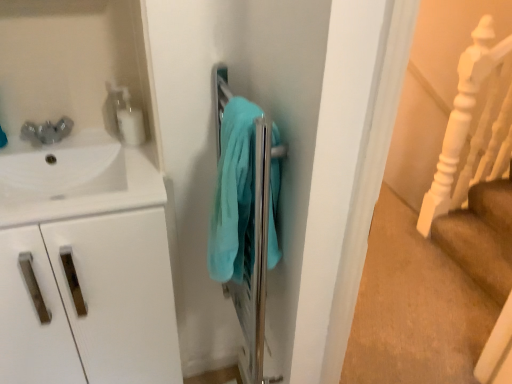
Locate an element on the screen. The image size is (512, 384). white wooden stair rail at right is located at coordinates (461, 117).

This screenshot has height=384, width=512. What do you see at coordinates (461, 117) in the screenshot?
I see `white wooden stair rail at right` at bounding box center [461, 117].

What do you see at coordinates (128, 117) in the screenshot? The image size is (512, 384). I see `white glossy soap dispenser at upper left` at bounding box center [128, 117].

You are a GUI agent. You are given a task and a screenshot of the screen. Output one action in this format:
    pyautogui.click(x=<x>, y=<y>)
    Task: Click on the teal soft towel at center
    This screenshot has height=384, width=512.
    Given the screenshot: What is the action you would take?
    pyautogui.click(x=234, y=196)

Is white matte cabinet at left at the right side of white glossy soap dispenser at upper left?

Incorrect, white matte cabinet at left is not on the right side of white glossy soap dispenser at upper left.

Image resolution: width=512 pixels, height=384 pixels. I want to click on drawer on the left of white glossy soap dispenser at upper left, so click(93, 302).

Which is behind, point (140, 276) or point (134, 113)?

The point (134, 113) is farther from the camera.

How many degrees apart are the facing directions of white matte cabinet at left and white glossy soap dispenser at upper left?

The angle between the facing direction of white matte cabinet at left and the facing direction of white glossy soap dispenser at upper left is 4.95 degrees.

The image size is (512, 384). I want to click on bath towel located in front of the white wooden stair rail at right, so click(234, 196).

Considering the sizes of teal soft towel at center and white wooden stair rail at right in the image, is teal soft towel at center bigger or smaller than white wooden stair rail at right?

Considering their sizes, teal soft towel at center takes up less space than white wooden stair rail at right.

Does teal soft towel at center turn towards white wooden stair rail at right?

No, teal soft towel at center is not oriented towards white wooden stair rail at right.

Is white wooden stair rail at right completely or partially inside teal soft towel at center?

No, teal soft towel at center does not contain white wooden stair rail at right.

Which object is further away from the camera taking this photo, white glossy soap dispenser at upper left or white wooden stair rail at right?

Positioned behind is white wooden stair rail at right.

Is white glossy soap dispenser at upper left not close to white wooden stair rail at right?

white glossy soap dispenser at upper left is far away from white wooden stair rail at right.

Does white glossy soap dispenser at upper left have a lesser width compared to white wooden stair rail at right?

Yes, white glossy soap dispenser at upper left is thinner than white wooden stair rail at right.

Can you tell me how much white glossy soap dispenser at upper left and white wooden stair rail at right differ in facing direction?

The angle between the facing direction of white glossy soap dispenser at upper left and the facing direction of white wooden stair rail at right is 93.3 degrees.

Who is taller, white wooden stair rail at right or white matte cabinet at left?

With more height is white wooden stair rail at right.

How many degrees apart are the facing directions of white wooden stair rail at right and white matte cabinet at left?

The facing directions of white wooden stair rail at right and white matte cabinet at left are 88.4 degrees apart.

Consider the image. From a real-world perspective, is white wooden stair rail at right under white matte cabinet at left?

No, from a real-world perspective, white wooden stair rail at right is not beneath white matte cabinet at left.

Is white wooden stair rail at right in front of white matte cabinet at left?

No, white wooden stair rail at right is further to the viewer.

Can you confirm if white glossy soap dispenser at upper left is taller than white glossy sink at upper left?

No.

Considering the positions of objects white glossy soap dispenser at upper left and white glossy sink at upper left in the image provided, who is behind, white glossy soap dispenser at upper left or white glossy sink at upper left?

Positioned behind is white glossy soap dispenser at upper left.

Measure the distance between white glossy soap dispenser at upper left and white glossy sink at upper left.

white glossy soap dispenser at upper left is 7.46 inches away from white glossy sink at upper left.

Is white glossy soap dispenser at upper left at the right side of white glossy sink at upper left?

Yes.

Is teal soft towel at center oriented towards white glossy soap dispenser at upper left?

No, teal soft towel at center does not turn towards white glossy soap dispenser at upper left.

Is teal soft towel at center positioned beyond the bounds of white glossy soap dispenser at upper left?

That's correct, teal soft towel at center is outside of white glossy soap dispenser at upper left.

Is teal soft towel at center surrounding white matte cabinet at left?

Definitely not — white matte cabinet at left is not inside teal soft towel at center.

Considering the relative positions of teal soft towel at center and white matte cabinet at left in the image provided, is teal soft towel at center to the left or to the right of white matte cabinet at left?

In the image, teal soft towel at center appears on the right side of white matte cabinet at left.

Who is smaller, teal soft towel at center or white matte cabinet at left?

Smaller between the two is teal soft towel at center.

Which of these two, teal soft towel at center or white matte cabinet at left, stands taller?

Standing taller between the two is white matte cabinet at left.

Find the location of a particular element. drawer directly beneath the white glossy soap dispenser at upper left (from a real-world perspective) is located at coordinates (93, 302).

Identify the location of rail behind the teal soft towel at center. (461, 117).

When comparing their distances from white glossy sink at upper left, does white matte cabinet at left or teal soft towel at center seem closer?

Among the two, white matte cabinet at left is located nearer to white glossy sink at upper left.

When comparing their distances from white wooden stair rail at right, does white glossy soap dispenser at upper left or white glossy sink at upper left seem further?

Based on the image, white glossy sink at upper left appears to be further to white wooden stair rail at right.

Based on their spatial positions, is white glossy sink at upper left or white glossy soap dispenser at upper left closer to white matte cabinet at left?

Among the two, white glossy sink at upper left is located nearer to white matte cabinet at left.

When comparing their distances from white matte cabinet at left, does white wooden stair rail at right or white glossy sink at upper left seem further?

white wooden stair rail at right is positioned further to the anchor white matte cabinet at left.

Estimate the real-world distances between objects in this image. Which object is closer to white matte cabinet at left, white glossy sink at upper left or teal soft towel at center?

white glossy sink at upper left is positioned closer to the anchor white matte cabinet at left.

In the scene shown: Considering their positions, is white matte cabinet at left positioned closer to white glossy soap dispenser at upper left than teal soft towel at center?

teal soft towel at center is positioned closer to the anchor white glossy soap dispenser at upper left.

Which object lies further to the anchor point white glossy soap dispenser at upper left, white glossy sink at upper left or teal soft towel at center?

Based on the image, teal soft towel at center appears to be further to white glossy soap dispenser at upper left.

Consider the image. From the image, which object appears to be nearer to white wooden stair rail at right, white matte cabinet at left or white glossy soap dispenser at upper left?

Among the two, white glossy soap dispenser at upper left is located nearer to white wooden stair rail at right.

Locate an element on the screen. This screenshot has height=384, width=512. soap dispenser between white glossy sink at upper left and teal soft towel at center in the horizontal direction is located at coordinates (128, 117).

Locate an element on the screen. Image resolution: width=512 pixels, height=384 pixels. sink located between white matte cabinet at left and white wooden stair rail at right in the left-right direction is located at coordinates (74, 179).

The height and width of the screenshot is (384, 512). In order to click on bath towel between white glossy sink at upper left and white wooden stair rail at right in the horizontal direction in this screenshot , I will do `click(234, 196)`.

At what (x,y) coordinates should I click in order to perform the action: click on soap dispenser between white matte cabinet at left and white wooden stair rail at right from left to right. Please return your answer as a coordinate pair (x, y). This screenshot has height=384, width=512. Looking at the image, I should click on (128, 117).